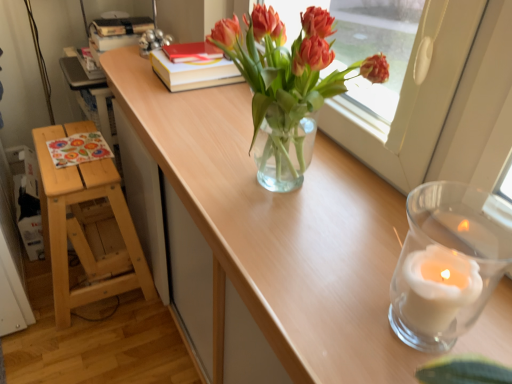
Find the location of a particular element. blank space above clear wood table at center (from a real-world perspective) is located at coordinates (246, 156).